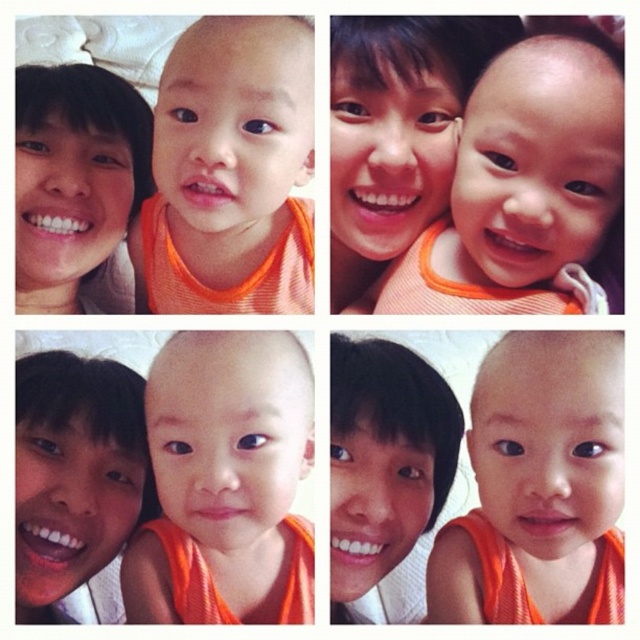
Question: Is orange fabric baby at center positioned in front of smooth skin face at center?

Choices:
 (A) no
 (B) yes

Answer: (B)

Question: Which point is farther to the camera?

Choices:
 (A) matte orange bib at upper left
 (B) orange fabric baby at upper right
 (C) orange fabric baby at center
 (D) matte orange shirt at center

Answer: (A)

Question: Does matte orange baby at upper center come in front of matte orange bib at upper left?

Choices:
 (A) yes
 (B) no

Answer: (A)

Question: Which point is closer to the camera taking this photo?

Choices:
 (A) (492, 410)
 (B) (241, 177)

Answer: (A)

Question: Estimate the real-world distances between objects in this image. Which object is farther from the orange fabric baby at upper right?

Choices:
 (A) orange fabric baby at center
 (B) matte orange bib at lower left

Answer: (B)

Question: Can you confirm if orange fabric baby at center is bigger than matte orange bib at lower left?

Choices:
 (A) yes
 (B) no

Answer: (A)